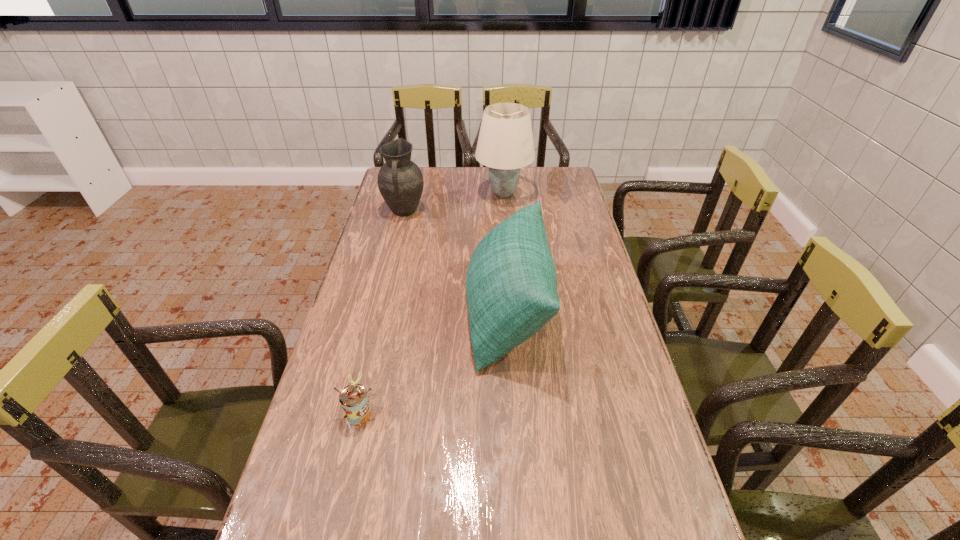
This screenshot has width=960, height=540. Find the location of `blank region between the pitcher and the shortest object`. blank region between the pitcher and the shortest object is located at coordinates (382, 312).

Identify the location of blank region between the can and the lampshade. (431, 303).

Where is `blank region between the second nearest object and the nearest object`? blank region between the second nearest object and the nearest object is located at coordinates (434, 362).

Locate an element on the screen. The height and width of the screenshot is (540, 960). the second closest object to the tallest object is located at coordinates (511, 284).

You are a GUI agent. You are given a task and a screenshot of the screen. Output one action in this format:
    pyautogui.click(x=<x>, y=<y>)
    Task: Click on the second closest object relative to the cushion
    
    Given the screenshot: What is the action you would take?
    pyautogui.click(x=400, y=181)

At what (x,y) coordinates should I click in order to perform the action: click on vacant region that satisfies the following two spatial constraints: 1. on the side of the shortest object with the handle; 2. on the left side of the pitcher. Please return your answer as a coordinate pair (x, y). This screenshot has width=960, height=540. Looking at the image, I should click on (356, 413).

Where is `vacant point that satisfies the following two spatial constraints: 1. on the front-facing side of the cushion; 2. on the front side of the shortest object`? This screenshot has height=540, width=960. vacant point that satisfies the following two spatial constraints: 1. on the front-facing side of the cushion; 2. on the front side of the shortest object is located at coordinates (516, 413).

Image resolution: width=960 pixels, height=540 pixels. Identify the location of vacant space that satisfies the following two spatial constraints: 1. on the front side of the tallest object; 2. on the front-facing side of the third farthest object. (513, 312).